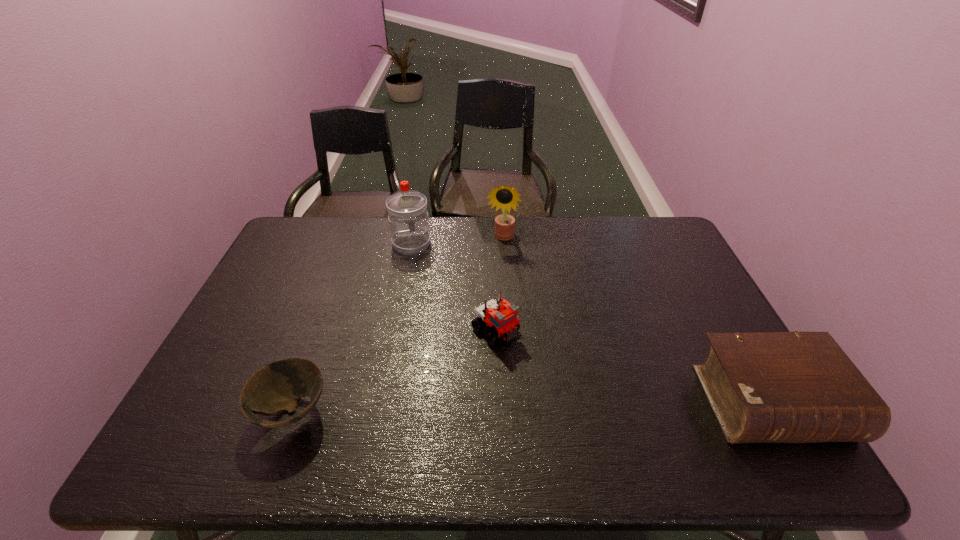
You are a GUI agent. You are given a task and a screenshot of the screen. Output one action in this format:
    pyautogui.click(x=<x>, y=<y>)
    Task: Click on the vacant point located between the leftmost object and the third nearest object
    This screenshot has height=540, width=960.
    Given the screenshot: What is the action you would take?
    pyautogui.click(x=394, y=370)

Find the location of `vacant space that is in between the Lego and the Bible`. vacant space that is in between the Lego and the Bible is located at coordinates [634, 367].

Where is `vacant space that's between the rightmost object and the fourth object from right to left`? vacant space that's between the rightmost object and the fourth object from right to left is located at coordinates (591, 323).

The width and height of the screenshot is (960, 540). What are the coordinates of `empty location between the shortest object and the Bible` in the screenshot? It's located at (532, 407).

Identify the location of free space between the sunflower and the third nearest object. The width and height of the screenshot is (960, 540). (498, 284).

Locate an element on the screen. The width and height of the screenshot is (960, 540). empty location between the rightmost object and the third farthest object is located at coordinates (634, 367).

Where is `blank region between the Bible and the bowl`? blank region between the Bible and the bowl is located at coordinates (532, 407).

Locate an element on the screen. This screenshot has height=540, width=960. vacant area that lies between the third nearest object and the Bible is located at coordinates (634, 367).

Where is `vacant space that is in between the sunflower and the second object from left to right`? Image resolution: width=960 pixels, height=540 pixels. vacant space that is in between the sunflower and the second object from left to right is located at coordinates (457, 241).

Find the location of a particular element. blank region between the sunflower and the Lego is located at coordinates (498, 284).